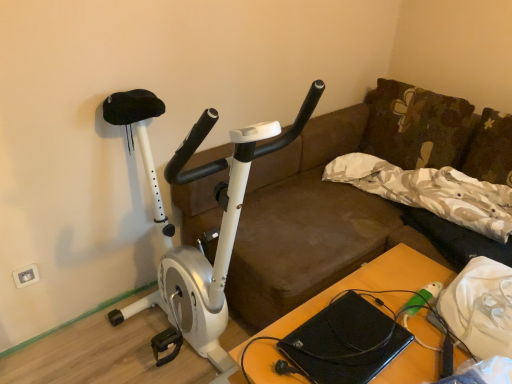
You are a GUI agent. You are given a task and a screenshot of the screen. Output one action in this format:
    pyautogui.click(x=<x>, y=<y>)
    Task: Click on the empty space that is ontop of wooden table at center (from a real-world perspective)
    
    Given the screenshot: What is the action you would take?
    pyautogui.click(x=374, y=324)